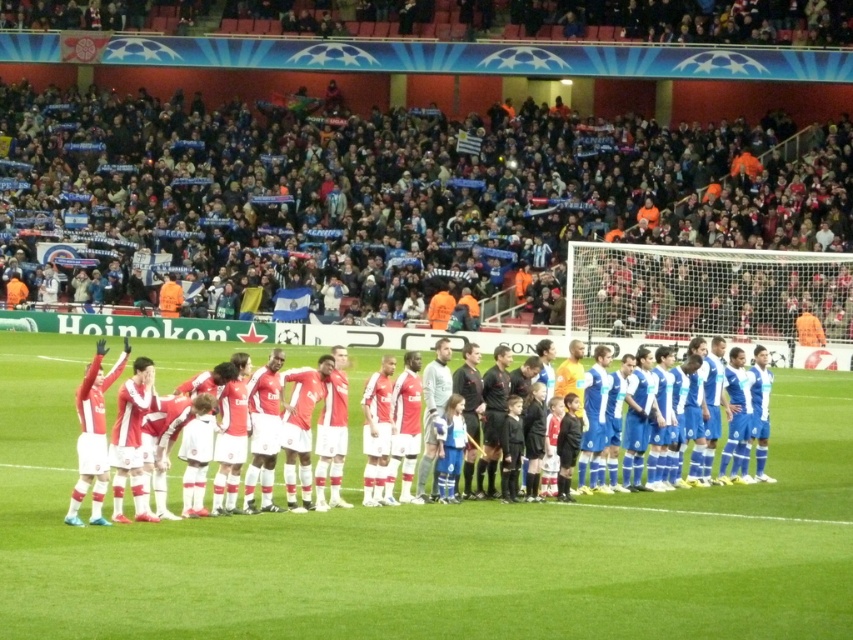
You are a photographer at the soccer match and want to capture a photo that includes both the dark blue fabric crowd at upper center and the matte red jersey at center. Which object should be placed on the left side of the photo to ensure both are visible?

The dark blue fabric crowd at upper center should be placed on the left side of the photo because it is already positioned on the left side of the matte red jersey at center, ensuring both are visible.